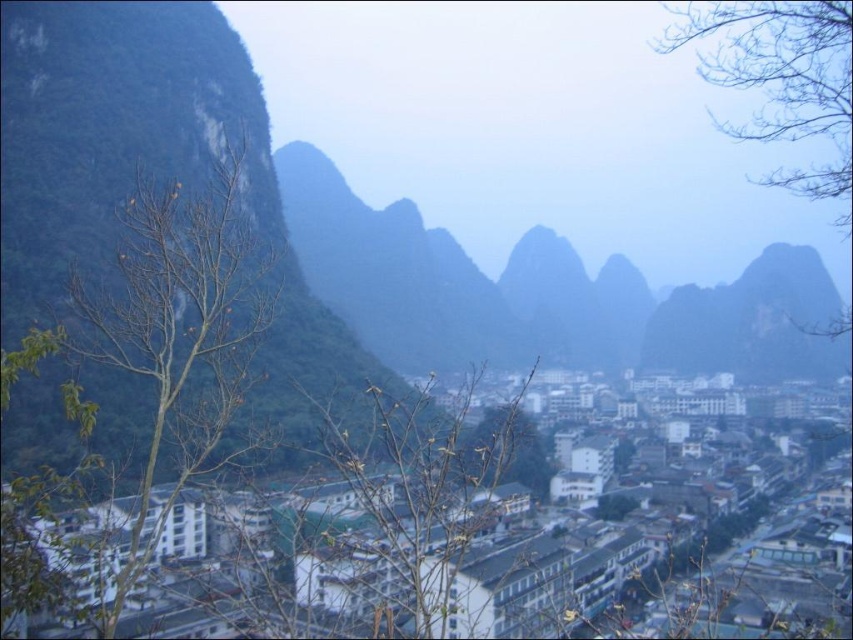
Question: Which point is closer to the camera?

Choices:
 (A) bare branches at upper right
 (B) green rock at left
 (C) white matte buildings at center

Answer: (C)

Question: Which of the following is the farthest from the observer?

Choices:
 (A) (851, 67)
 (B) (187, 97)
 (C) (503, 532)

Answer: (B)

Question: Can you confirm if brown leafless tree at left is bigger than bare branches at upper right?

Choices:
 (A) yes
 (B) no

Answer: (B)

Question: Estimate the real-world distances between objects in this image. Which object is closer to the bare branches at upper right?

Choices:
 (A) green rock at left
 (B) brown leafless tree at center
 (C) brown leafless tree at left

Answer: (C)

Question: Is green rock at left positioned behind bare branches at upper right?

Choices:
 (A) yes
 (B) no

Answer: (B)

Question: Does white matte buildings at center have a greater width compared to bare branches at upper right?

Choices:
 (A) no
 (B) yes

Answer: (A)